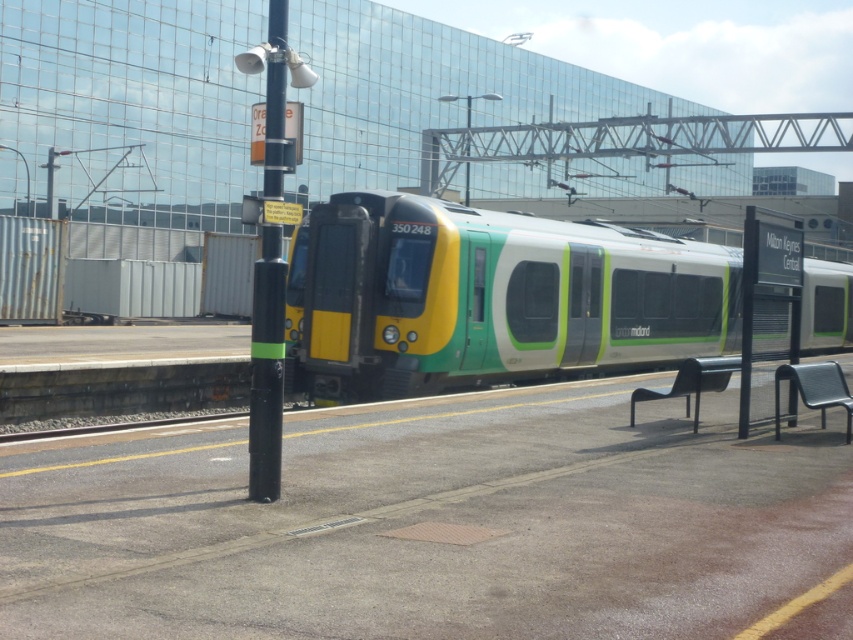
Which of these two, green matte train at center or black/green plastic pole at left, stands shorter?

Standing shorter between the two is green matte train at center.

Looking at this image, between green matte train at center and black/green plastic pole at left, which one is positioned lower?

green matte train at center is below.

Between point (666, 272) and point (276, 384), which one is positioned behind?

The point (666, 272) is behind.

Find the location of a particular element. This screenshot has height=640, width=853. green matte train at center is located at coordinates tap(490, 298).